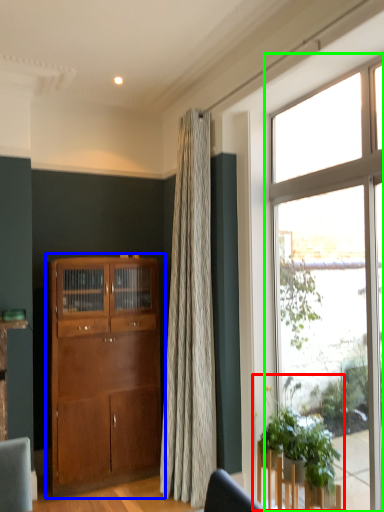
Question: Which object is the farthest from houseplant (highlighted by a red box)? Choose among these: cabinetry (highlighted by a blue box) or window (highlighted by a green box).

Choices:
 (A) cabinetry
 (B) window

Answer: (A)